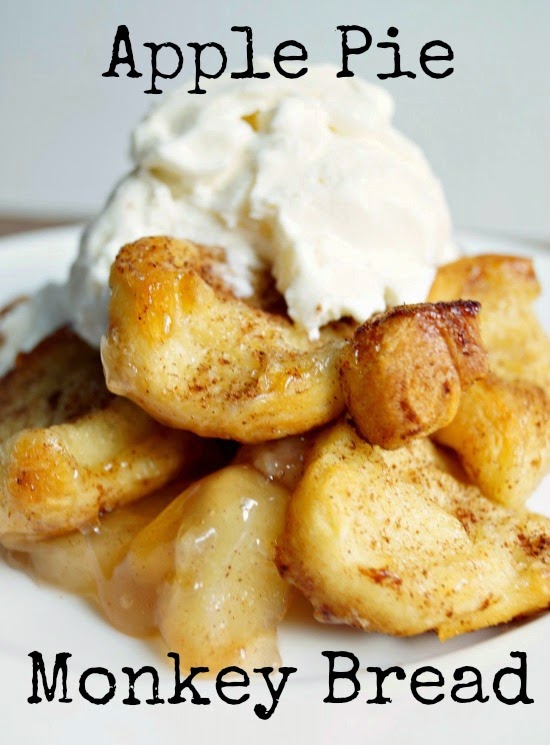
The height and width of the screenshot is (745, 550). Find the location of `table`. table is located at coordinates (13, 223).